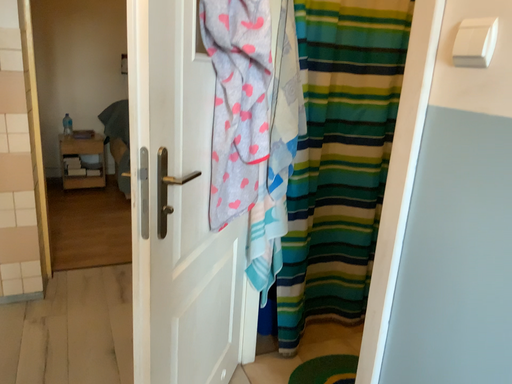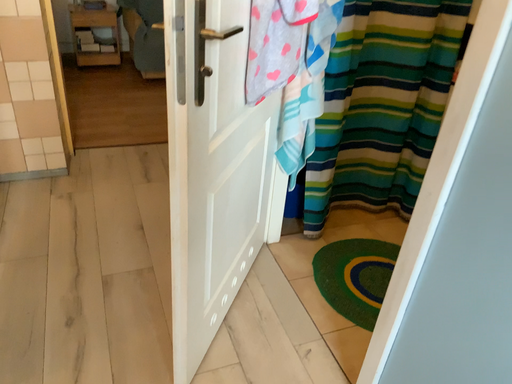
Question: How did the camera likely rotate when shooting the video?

Choices:
 (A) rotated upward
 (B) rotated downward

Answer: (B)